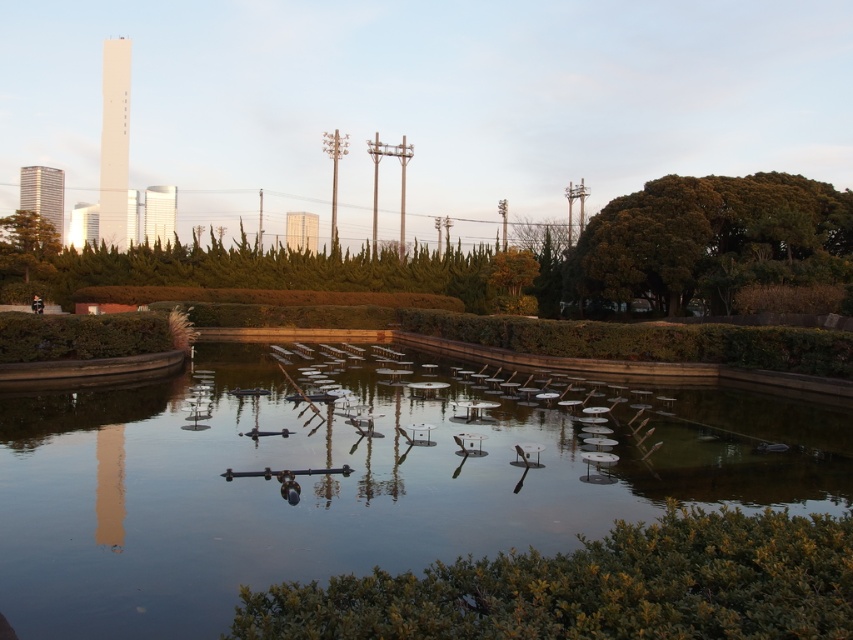
Between green leafy tree at upper right and glassy reflective skyscraper at upper left, which one is positioned higher?

glassy reflective skyscraper at upper left is higher up.

This screenshot has height=640, width=853. What do you see at coordinates (711, 241) in the screenshot?
I see `green leafy tree at upper right` at bounding box center [711, 241].

Does point (787, 188) come in front of point (44, 166)?

Yes, it is in front of point (44, 166).

Find the location of a particular element. green leafy tree at upper right is located at coordinates (711, 241).

Who is more forward, (155, 221) or (291, 230)?

Point (291, 230) is in front.

Can you confirm if smooth glass tower at upper center is taller than white glossy tower at center?

Correct, smooth glass tower at upper center is much taller as white glossy tower at center.

Who is more distant from viewer, (161, 209) or (289, 227)?

Positioned behind is point (161, 209).

The height and width of the screenshot is (640, 853). Find the location of `smooth glass tower at upper center`. smooth glass tower at upper center is located at coordinates (160, 214).

Is the position of transparent glass water at center more distant than that of smooth glass tower at upper center?

No, it is in front of smooth glass tower at upper center.

Between transparent glass water at center and smooth glass tower at upper center, which one appears on the right side from the viewer's perspective?

From the viewer's perspective, transparent glass water at center appears more on the right side.

Image resolution: width=853 pixels, height=640 pixels. Describe the element at coordinates (354, 477) in the screenshot. I see `transparent glass water at center` at that location.

You are a GUI agent. You are given a task and a screenshot of the screen. Output one action in this format:
    pyautogui.click(x=<x>, y=<y>)
    Task: Click on the transparent glass water at center
    This screenshot has width=853, height=640.
    Given the screenshot: What is the action you would take?
    pyautogui.click(x=354, y=477)